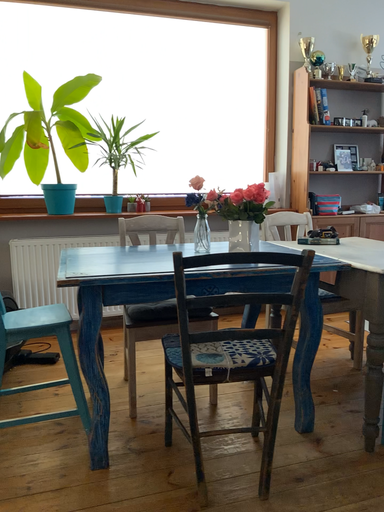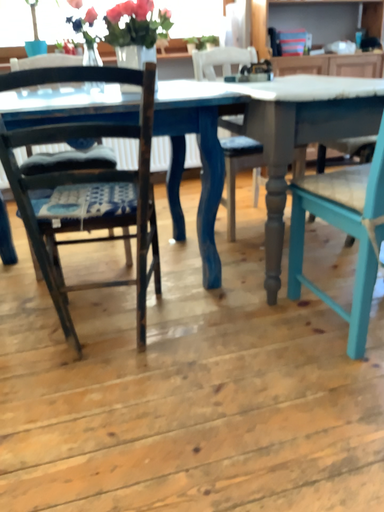
Question: How did the camera likely rotate when shooting the video?

Choices:
 (A) rotated downward
 (B) rotated upward

Answer: (A)